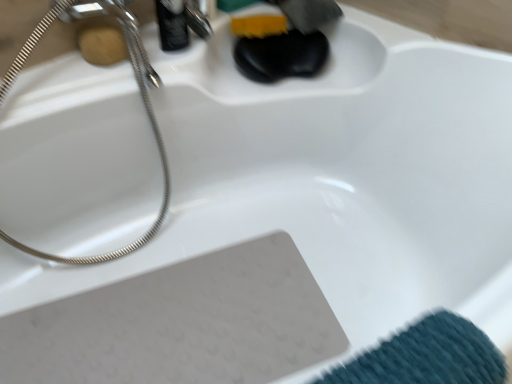
The width and height of the screenshot is (512, 384). In order to click on satin nickel shower head at upper left in this screenshot , I will do `click(155, 138)`.

From the image's perspective, is polished chrome faucet at upper center above or below satin nickel shower head at upper left?

Based on their image positions, polished chrome faucet at upper center is located above satin nickel shower head at upper left.

Do you think polished chrome faucet at upper center is within satin nickel shower head at upper left, or outside of it?

polished chrome faucet at upper center is spatially situated outside satin nickel shower head at upper left.

The image size is (512, 384). What are the coordinates of `soap lying on the right of satin nickel shower head at upper left` in the screenshot? It's located at (102, 45).

Considering the relative positions of satin nickel shower head at upper left and wooden soap at upper left in the image provided, is satin nickel shower head at upper left to the left or to the right of wooden soap at upper left?

In the image, satin nickel shower head at upper left appears on the left side of wooden soap at upper left.

Is satin nickel shower head at upper left not inside wooden soap at upper left?

Absolutely, satin nickel shower head at upper left is external to wooden soap at upper left.

Is satin nickel shower head at upper left not near wooden soap at upper left?

They are positioned close to each other.

From the image's perspective, which one is positioned lower, polished chrome faucet at upper center or wooden soap at upper left?

wooden soap at upper left is shown below in the image.

Does polished chrome faucet at upper center appear on the left side of wooden soap at upper left?

No, polished chrome faucet at upper center is not to the left of wooden soap at upper left.

Does point (179, 22) come closer to viewer compared to point (123, 41)?

No, (179, 22) is behind (123, 41).

Can you tell me how much polished chrome faucet at upper center and wooden soap at upper left differ in facing direction?

0.000921 degrees separate the facing orientations of polished chrome faucet at upper center and wooden soap at upper left.

Can you tell me how much wooden soap at upper left and satin nickel shower head at upper left differ in facing direction?

0.0598 degrees separate the facing orientations of wooden soap at upper left and satin nickel shower head at upper left.

In the image, there is a satin nickel shower head at upper left. In order to click on soap above it (from the image's perspective) in this screenshot , I will do `click(102, 45)`.

Does wooden soap at upper left come behind satin nickel shower head at upper left?

Yes, it is.

From a real-world perspective, which object stands above the other?

wooden soap at upper left, from a real-world perspective.

Which point is more distant from viewer, (x=86, y=60) or (x=185, y=38)?

The point (x=185, y=38) is behind.

Is polished chrome faucet at upper center at the back of wooden soap at upper left?

No, wooden soap at upper left is not facing away from polished chrome faucet at upper center.

Is wooden soap at upper left far from polished chrome faucet at upper center?

No, wooden soap at upper left is not far from polished chrome faucet at upper center.

In terms of height, does satin nickel shower head at upper left look taller or shorter compared to polished chrome faucet at upper center?

Considering their sizes, satin nickel shower head at upper left has more height than polished chrome faucet at upper center.

From a real-world perspective, which is physically above, satin nickel shower head at upper left or polished chrome faucet at upper center?

polished chrome faucet at upper center, from a real-world perspective.

Considering the sizes of objects satin nickel shower head at upper left and polished chrome faucet at upper center in the image provided, who is smaller, satin nickel shower head at upper left or polished chrome faucet at upper center?

polished chrome faucet at upper center.

Can you tell me how much satin nickel shower head at upper left and polished chrome faucet at upper center differ in facing direction?

0.0603 degrees.

At what (x,y) coordinates should I click in order to perform the action: click on faucet on the right side of satin nickel shower head at upper left. Please return your answer as a coordinate pair (x, y). The height and width of the screenshot is (384, 512). Looking at the image, I should click on (180, 23).

The height and width of the screenshot is (384, 512). What are the coordinates of `soap above the satin nickel shower head at upper left (from a real-world perspective)` in the screenshot? It's located at (102, 45).

When comparing their distances from wooden soap at upper left, does polished chrome faucet at upper center or satin nickel shower head at upper left seem closer?

polished chrome faucet at upper center is closer to wooden soap at upper left.

From the image, which object appears to be nearer to satin nickel shower head at upper left, polished chrome faucet at upper center or wooden soap at upper left?

wooden soap at upper left lies closer to satin nickel shower head at upper left than the other object.

Looking at the image, which one is located further to satin nickel shower head at upper left, wooden soap at upper left or polished chrome faucet at upper center?

Among the two, polished chrome faucet at upper center is located further to satin nickel shower head at upper left.

When comparing their distances from polished chrome faucet at upper center, does wooden soap at upper left or satin nickel shower head at upper left seem further?

Among the two, satin nickel shower head at upper left is located further to polished chrome faucet at upper center.

When comparing their distances from polished chrome faucet at upper center, does satin nickel shower head at upper left or wooden soap at upper left seem further?

satin nickel shower head at upper left is further to polished chrome faucet at upper center.

From the image, which object appears to be nearer to wooden soap at upper left, satin nickel shower head at upper left or polished chrome faucet at upper center?

polished chrome faucet at upper center is positioned closer to the anchor wooden soap at upper left.

This screenshot has height=384, width=512. I want to click on soap between satin nickel shower head at upper left and polished chrome faucet at upper center from front to back, so click(102, 45).